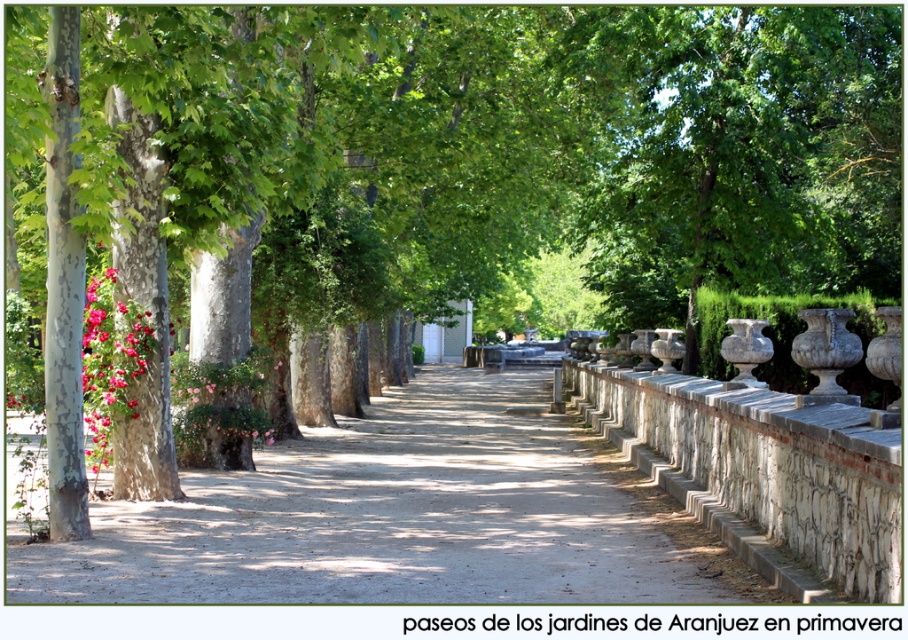
You are a gardener walking along the dirt path at center and want to reach the pink matte flowers at left to water them. Which direction should you move relative to the path?

Since the dirt path at center is in front of the pink matte flowers at left, you should move to the left side of the path to reach the pink matte flowers at left.

You are a gardener planning to walk along the dirt path at center while avoiding the pink matte flowers at left. Can you walk sideways without stepping on the flowers?

The dirt path at center is wider than the pink matte flowers at left, so yes, you can walk sideways without stepping on the flowers.